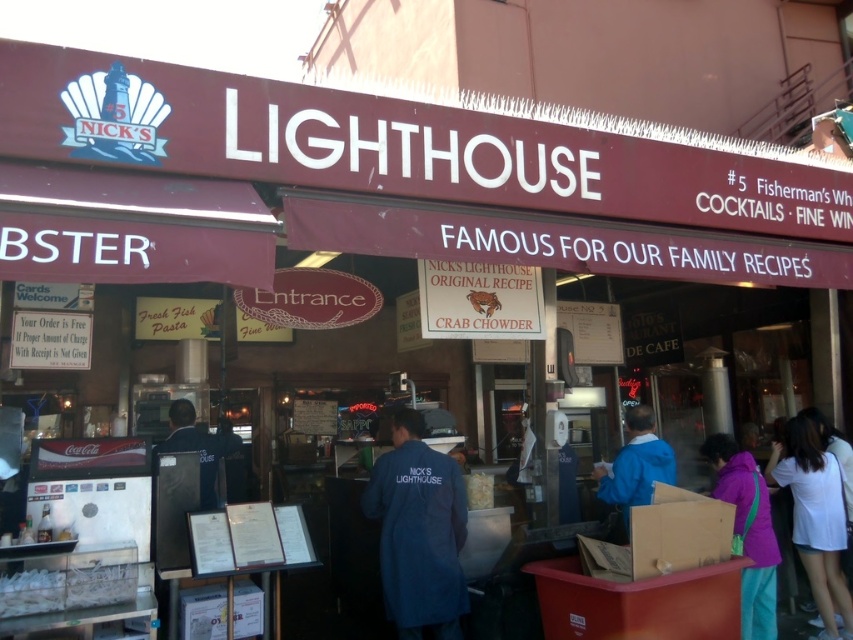
You are standing at the entrance of Nick Lighthouse restaurant. You see two points marked on the wall. One is at point (460,484) and the other at point (819,541). Which point is closer to you?

Point (460,484) is closer to the viewer than point (819,541).

Consider the image. You are a customer entering the restaurant and see both the white cotton shirt at lower right and the blue fabric jacket at center. Which clothing item takes up more space in the image?

A: The white cotton shirt at lower right is larger in size than the blue fabric jacket at center, so it takes up more space in the image.